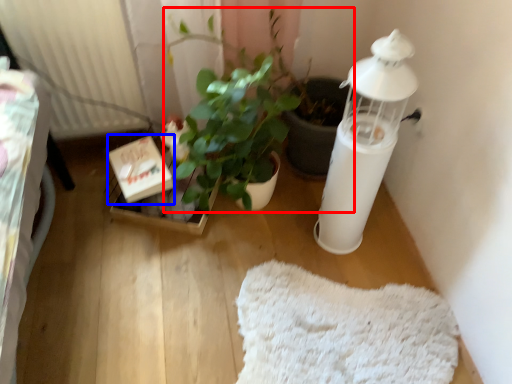
Question: Which point is closer to the camera, houseplant (highlighted by a red box) or cardboard box (highlighted by a blue box)?

Choices:
 (A) houseplant
 (B) cardboard box

Answer: (A)